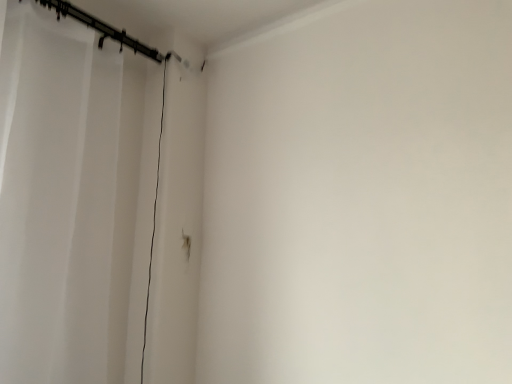
This screenshot has width=512, height=384. What do you see at coordinates (64, 200) in the screenshot?
I see `white sheer curtain at left` at bounding box center [64, 200].

Identify the location of white sheer curtain at left. (64, 200).

You are a GUI agent. You are given a task and a screenshot of the screen. Output one action in this format:
    pyautogui.click(x=<x>, y=<y>)
    Task: Click on the white sheer curtain at left
    The width and height of the screenshot is (512, 384).
    Given the screenshot: What is the action you would take?
    pyautogui.click(x=64, y=200)